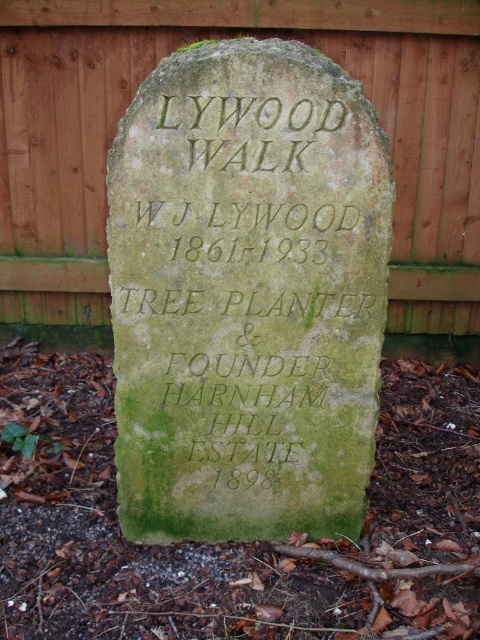
Is green mossy stone at center shorter than wooden fence at upper center?

Incorrect, green mossy stone at center's height does not fall short of wooden fence at upper center's.

Does green mossy stone at center have a smaller size compared to wooden fence at upper center?

Indeed, green mossy stone at center has a smaller size compared to wooden fence at upper center.

Between point (127, 538) and point (136, 74), which one is positioned behind?

The point (136, 74) is behind.

Where is `green mossy stone at center`? Image resolution: width=480 pixels, height=640 pixels. green mossy stone at center is located at coordinates (247, 294).